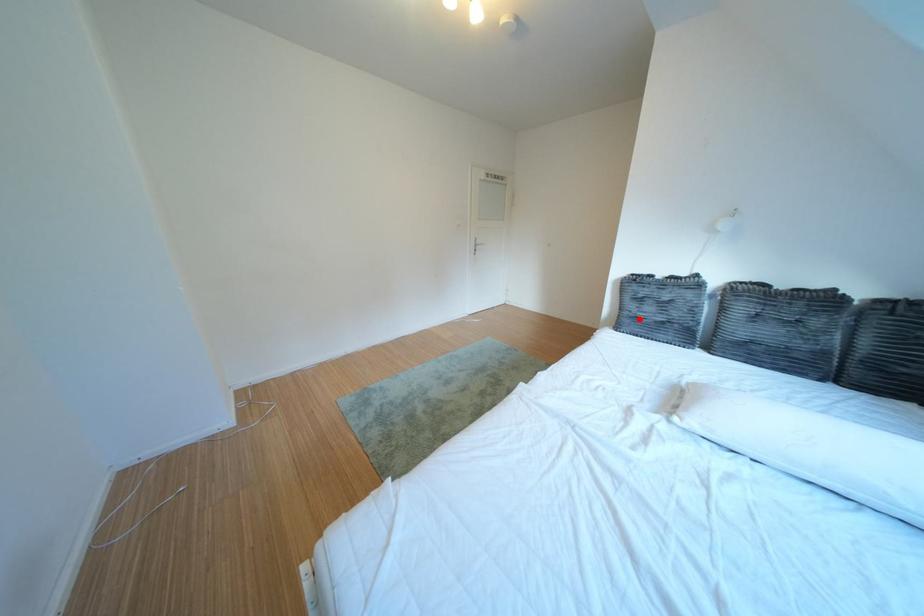
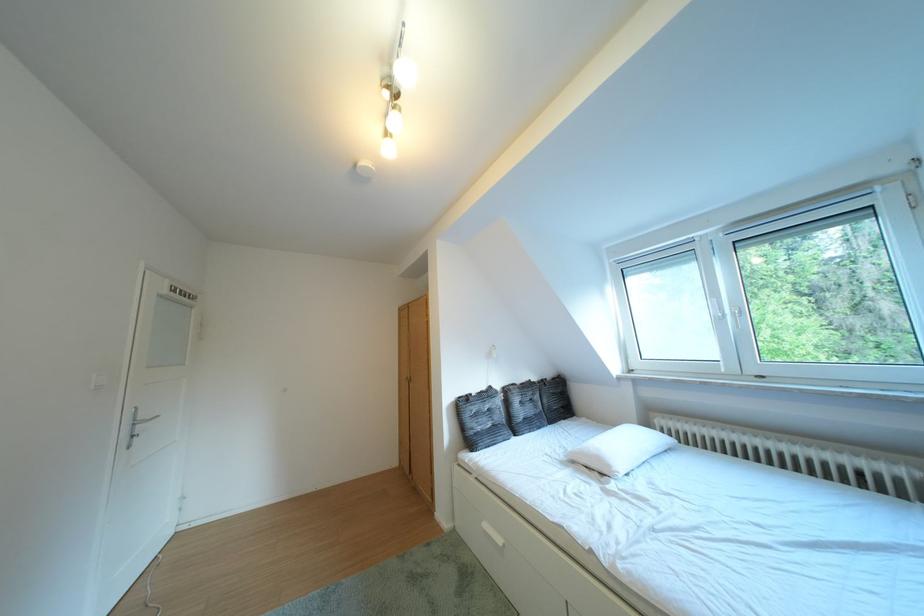
Question: I am providing you with two images of the same scene from different viewpoints. A red point is shown in image1. For the corresponding object point in image2, is it positioned nearer or farther from the camera?

Choices:
 (A) Nearer
 (B) Farther

Answer: (B)